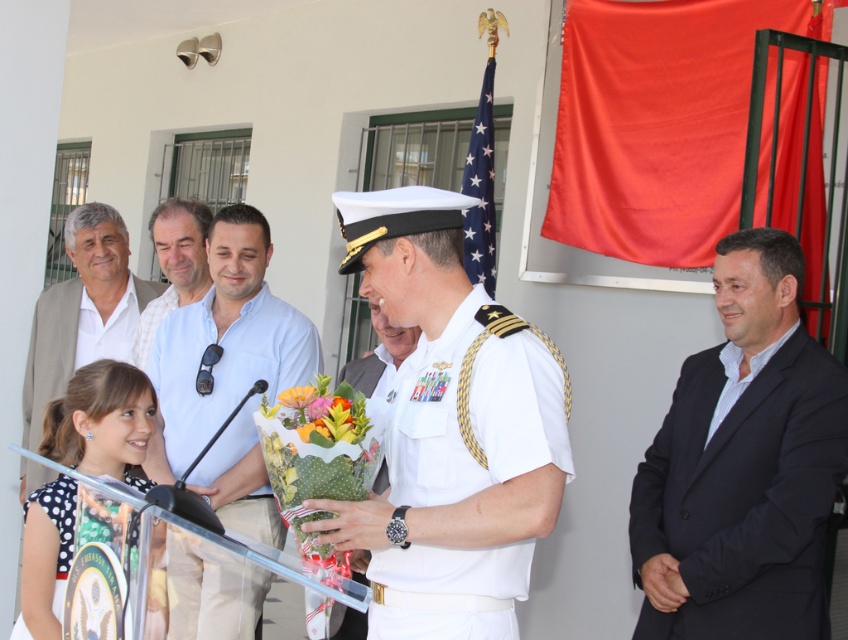
You are attending a formal event and see the white matte uniform at center and the yellow matte flower at center. Which object is larger in size?

The white matte uniform at center is bigger than the yellow matte flower at center.

You are attending this formal event and want to take a photo of the polka dot fabric dress at lower left and the glossy floral bouquet at center. Which object should you focus on first to ensure it appears sharp in the photo?

The polka dot fabric dress at lower left is in front of the glossy floral bouquet at center, so you should focus on the polka dot fabric dress at lower left first to ensure it appears sharp in the photo.

You are a photographer at the event and need to frame a shot that includes both the white matte uniform at center and the yellow matte flower at center. Which object should you adjust your camera to focus on first to ensure it captures the full width of both subjects?

You should focus on the white matte uniform at center first because its width is larger than the yellow matte flower at center, ensuring the camera captures the wider subject before adjusting for the smaller one.